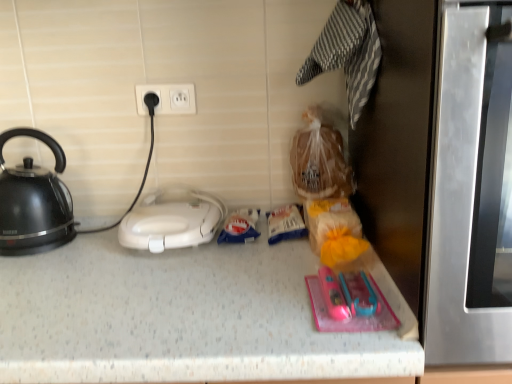
Question: Is white plastic toaster at center thinner than stainless steel oven at right?

Choices:
 (A) yes
 (B) no

Answer: (A)

Question: From the image's perspective, is white plastic toaster at center on top of stainless steel oven at right?

Choices:
 (A) yes
 (B) no

Answer: (B)

Question: Does white plastic toaster at center lie in front of stainless steel oven at right?

Choices:
 (A) yes
 (B) no

Answer: (B)

Question: Is the position of white plastic toaster at center more distant than that of stainless steel oven at right?

Choices:
 (A) yes
 (B) no

Answer: (A)

Question: Would you say white plastic toaster at center is outside stainless steel oven at right?

Choices:
 (A) no
 (B) yes

Answer: (B)

Question: Looking at their shapes, would you say white plastic electric outlet at upper center is wider or thinner than white plastic toaster at center?

Choices:
 (A) wide
 (B) thin

Answer: (B)

Question: Is white plastic electric outlet at upper center spatially inside white plastic toaster at center, or outside of it?

Choices:
 (A) inside
 (B) outside

Answer: (B)

Question: From the image's perspective, relative to white plastic toaster at center, is white plastic electric outlet at upper center above or below?

Choices:
 (A) below
 (B) above

Answer: (B)

Question: Considering the relative positions of white plastic electric outlet at upper center and white plastic toaster at center in the image provided, is white plastic electric outlet at upper center to the left or to the right of white plastic toaster at center?

Choices:
 (A) right
 (B) left

Answer: (B)

Question: In terms of width, does white plastic toaster at center look wider or thinner when compared to black glossy kettle at left?

Choices:
 (A) wide
 (B) thin

Answer: (A)

Question: Considering the relative positions of white plastic toaster at center and black glossy kettle at left in the image provided, is white plastic toaster at center to the left or to the right of black glossy kettle at left?

Choices:
 (A) left
 (B) right

Answer: (B)

Question: Is white plastic toaster at center in front of or behind black glossy kettle at left in the image?

Choices:
 (A) front
 (B) behind

Answer: (A)

Question: Considering the positions of white plastic toaster at center and black glossy kettle at left in the image, is white plastic toaster at center taller or shorter than black glossy kettle at left?

Choices:
 (A) short
 (B) tall

Answer: (A)

Question: From the image's perspective, is white plastic electric outlet at upper center positioned above or below black glossy kettle at left?

Choices:
 (A) below
 (B) above

Answer: (B)

Question: Is white plastic electric outlet at upper center in front of or behind black glossy kettle at left in the image?

Choices:
 (A) behind
 (B) front

Answer: (A)